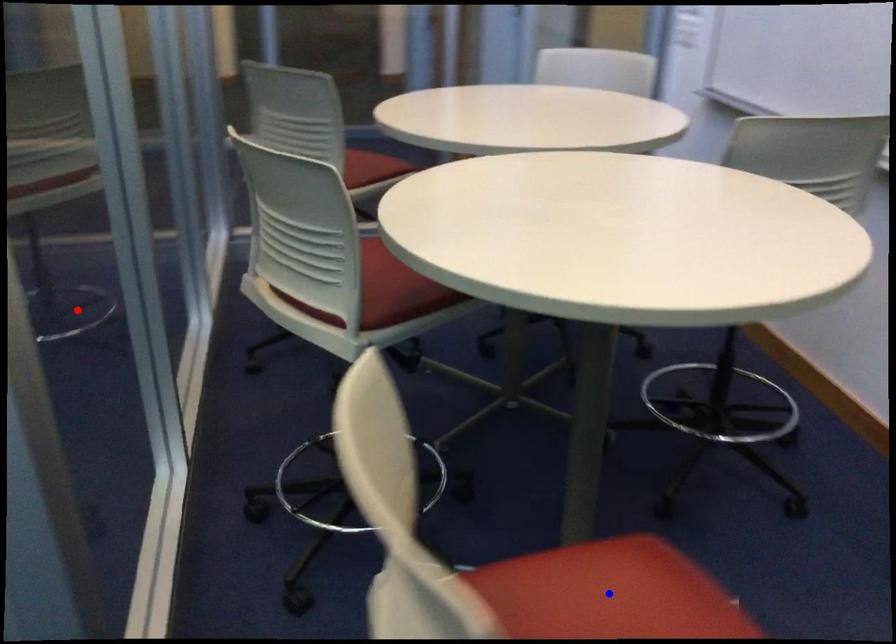
Question: Two points are marked on the image. Which point is closer to the camera?

Choices:
 (A) Blue point is closer.
 (B) Red point is closer.

Answer: (A)